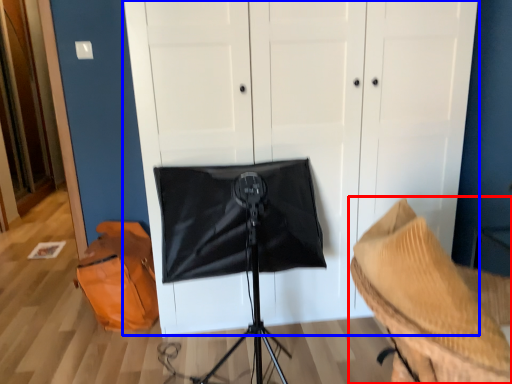
Question: Which of the following is the farthest to the observer, furniture (highlighted by a red box) or dresser (highlighted by a blue box)?

Choices:
 (A) furniture
 (B) dresser

Answer: (B)